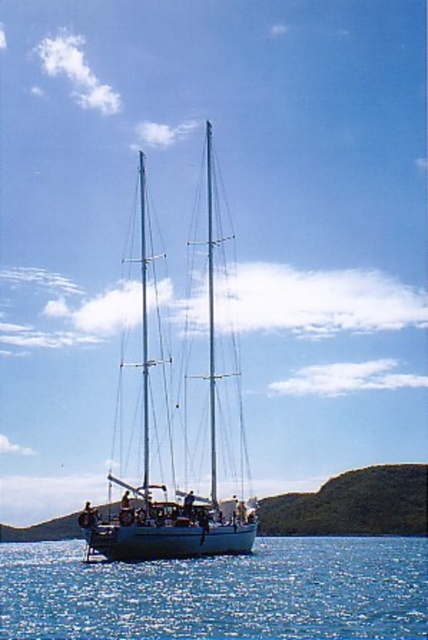
Question: Which point appears closest to the camera in this image?

Choices:
 (A) (187, 515)
 (B) (171, 624)

Answer: (B)

Question: Is blue liquid water at center closer to camera compared to white glossy sailboat at center?

Choices:
 (A) yes
 (B) no

Answer: (A)

Question: Which point is closer to the camera taking this photo?

Choices:
 (A) (419, 625)
 (B) (220, 513)

Answer: (A)

Question: Which object is farther from the camera taking this photo?

Choices:
 (A) blue liquid water at center
 (B) white glossy sailboat at center

Answer: (B)

Question: Can you confirm if blue liquid water at center is wider than white glossy sailboat at center?

Choices:
 (A) no
 (B) yes

Answer: (B)

Question: Can you confirm if blue liquid water at center is positioned to the right of white glossy sailboat at center?

Choices:
 (A) yes
 (B) no

Answer: (A)